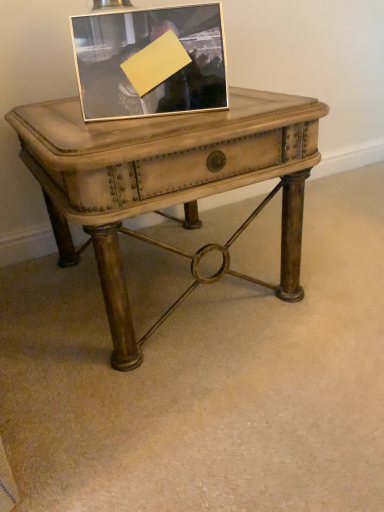
Where is `blank space situated above silver metallic picture frame at upper center (from a real-world perspective)`? The width and height of the screenshot is (384, 512). blank space situated above silver metallic picture frame at upper center (from a real-world perspective) is located at coordinates (144, 8).